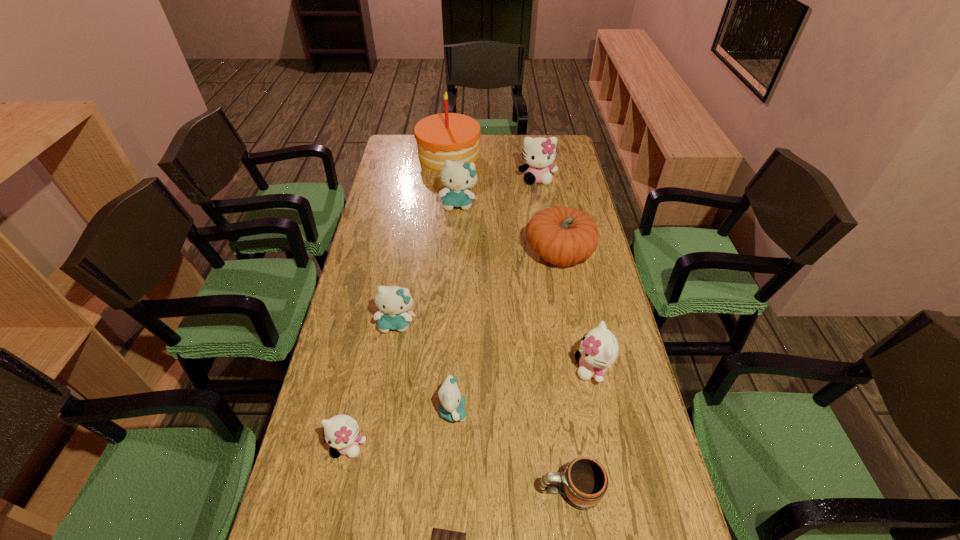
Find the location of `vacant space situated on the front-facing side of the farthest white kitten`. vacant space situated on the front-facing side of the farthest white kitten is located at coordinates (540, 201).

Locate an element on the screen. Image resolution: width=960 pixels, height=540 pixels. vacant space located 0.270m on the left of the seventh nearest object is located at coordinates (448, 253).

You are a GUI agent. You are given a task and a screenshot of the screen. Output one action in this format:
    pyautogui.click(x=<x>, y=<y>)
    Task: Click on the free space located on the front-facing side of the second nearest white kitten
    
    Given the screenshot: What is the action you would take?
    pyautogui.click(x=485, y=368)

I want to click on vacant area located 0.110m on the front-facing side of the second nearest white kitten, so click(535, 368).

The image size is (960, 540). I want to click on vacant region located 0.260m on the front-facing side of the second nearest white kitten, so click(x=481, y=368).

I want to click on vacant space located on the face of the leftmost blue kitten, so click(379, 429).

The height and width of the screenshot is (540, 960). I want to click on vacant space located on the face of the nearest blue kitten, so (571, 411).

Find the location of a particular element. free space located 0.100m on the front-facing side of the smallest white kitten is located at coordinates (335, 506).

This screenshot has width=960, height=540. In order to click on vacant space located 0.360m on the side of the second shortest object with the handle in this screenshot , I will do `click(380, 490)`.

Image resolution: width=960 pixels, height=540 pixels. I want to click on vacant region located on the side of the second shortest object with the handle, so click(x=516, y=490).